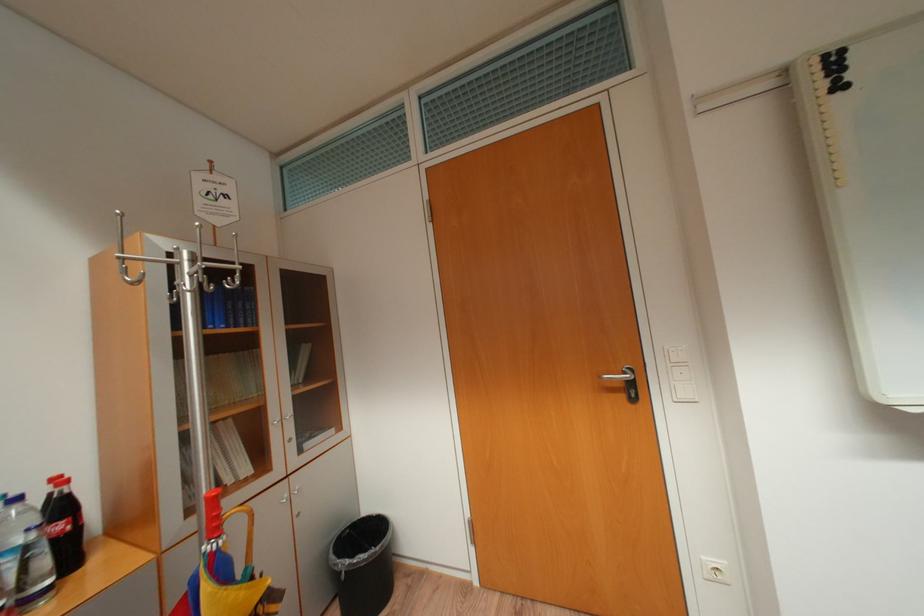
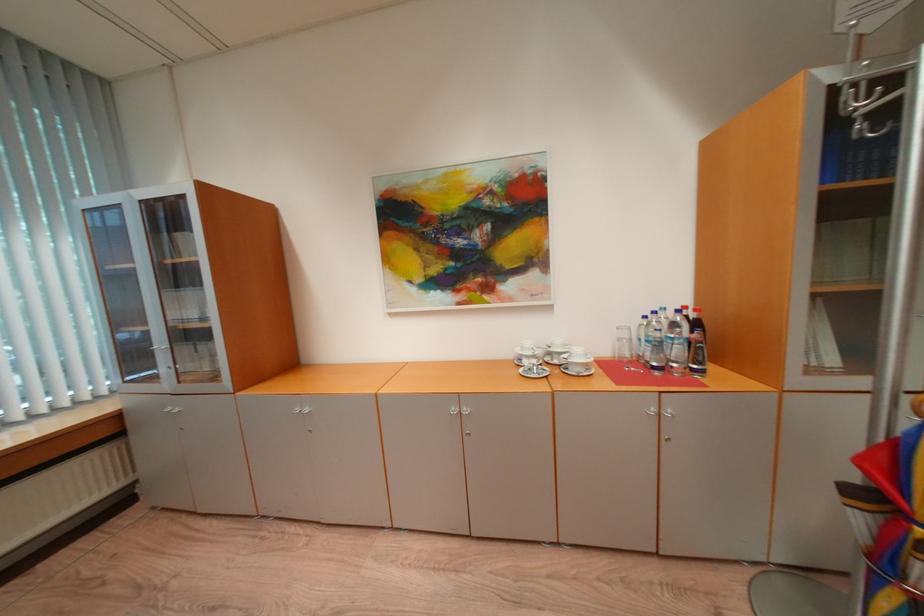
First-person continuous shooting, in which direction is the camera rotating?

The camera rotated toward left-down.